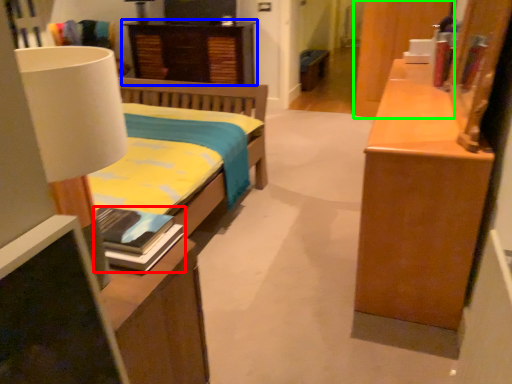
Question: Considering the real-world distances, which object is closest to book (highlighted by a red box)? nightstand (highlighted by a blue box) or cabinetry (highlighted by a green box).

Choices:
 (A) nightstand
 (B) cabinetry

Answer: (B)